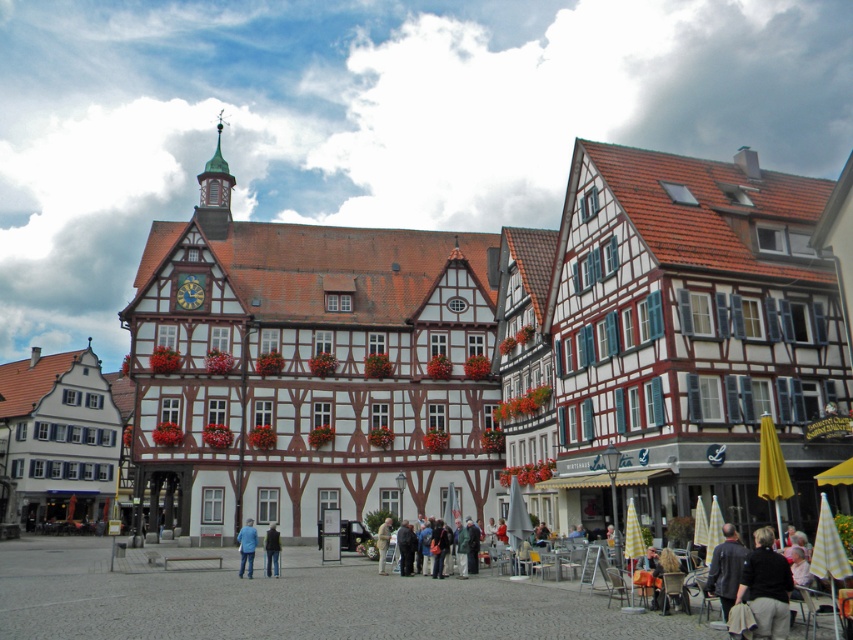
You are a photographer trying to capture both the blue denim jeans at center and the dark blue jacket at center in a single frame. Since you want to emphasize the larger object, which one should you focus on to ensure it stands out more in the photo?

The blue denim jeans at center is larger in size than the dark blue jacket at center, so focusing on the blue denim jeans at center will make it stand out more in the photo.

You are standing in the town square and want to reach a specific location marked by a point at coordinates point (766, 561). If you walk straight ahead, will you reach this point before walking 40 meters?

The point (766, 561) is 37.25 meters away from the viewer, so yes, walking straight ahead will reach it before 40 meters.